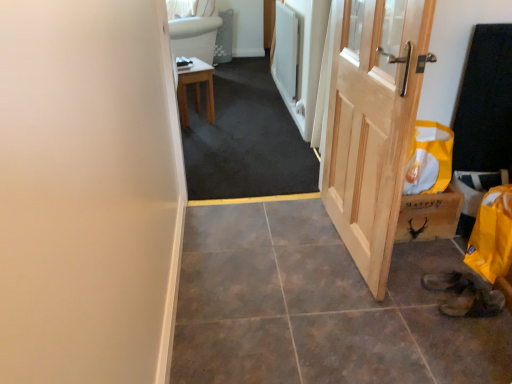
At what (x,y) coordinates should I click in order to perform the action: click on free region under natural wood door at right (from a real-world perspective). Please return your answer as a coordinate pair (x, y). This screenshot has width=512, height=384. Looking at the image, I should click on (338, 239).